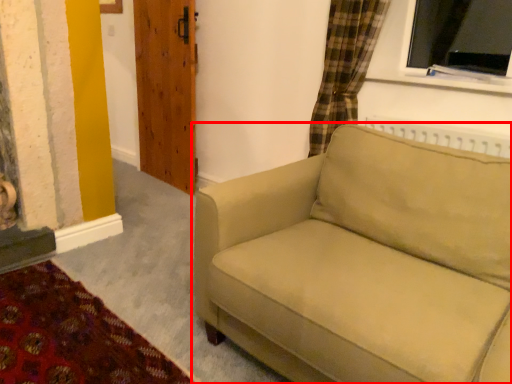
Question: From the image's perspective, considering the relative positions of studio couch (annotated by the red box) and door in the image provided, where is studio couch (annotated by the red box) located with respect to the staircase?

Choices:
 (A) above
 (B) below

Answer: (B)